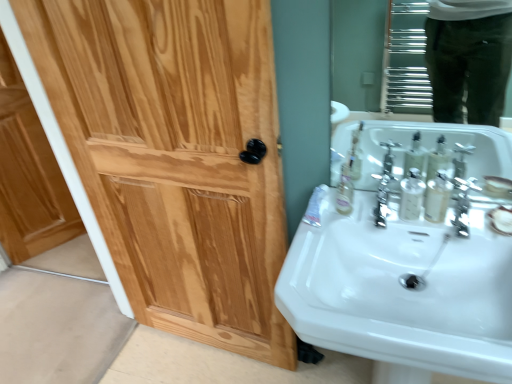
Identify the location of white glossy tube at lower right. Image resolution: width=512 pixels, height=384 pixels. (315, 206).

What is the approximate width of white glossy tube at lower right?

The width of white glossy tube at lower right is 6.39 inches.

The image size is (512, 384). What do you see at coordinates (437, 197) in the screenshot? I see `translucent plastic mouthwash at sink right, which ranks as the 2th mouthwash in left-to-right order` at bounding box center [437, 197].

This screenshot has width=512, height=384. Describe the element at coordinates (380, 56) in the screenshot. I see `glossy chrome mirror at upper right` at that location.

Locate an element on the screen. Image resolution: width=512 pixels, height=384 pixels. light brown wood door at left is located at coordinates pos(29,175).

Measure the distance between light brown wood door at left and camera.

The distance of light brown wood door at left from camera is 6.05 feet.

The image size is (512, 384). In order to click on white glossy tube at lower right in this screenshot , I will do `click(315, 206)`.

How far apart are glossy chrome mirror at upper right and white glossy sink at lower right?

glossy chrome mirror at upper right and white glossy sink at lower right are 1.85 meters apart from each other.

Is point (367, 64) positioned before point (499, 382)?

No, (367, 64) is behind (499, 382).

Is glossy chrome mirror at upper right facing away from white glossy sink at lower right?

That's not correct — glossy chrome mirror at upper right is not looking away from white glossy sink at lower right.

Based on the photo, from a real-world perspective, is glossy chrome mirror at upper right physically located above or below white glossy sink at lower right?

glossy chrome mirror at upper right is above white glossy sink at lower right.

Does light brown wood door at left come behind translucent plastic mouthwash at sink right, the first mouthwash positioned from the right?

That is True.

From a real-world perspective, which is physically below, light brown wood door at left or translucent plastic mouthwash at sink right, the first mouthwash positioned from the right?

In real-world perspective, light brown wood door at left is lower.

From the image's perspective, which object appears higher, light brown wood door at left or translucent plastic mouthwash at sink right, which ranks as the 2th mouthwash in left-to-right order?

light brown wood door at left is shown above in the image.

Can you tell me how much translucent plastic mouthwash at sink right, the first mouthwash positioned from the right, and white glossy tube at lower right differ in facing direction?

The facing directions of translucent plastic mouthwash at sink right, the first mouthwash positioned from the right, and white glossy tube at lower right are 2.43 degrees apart.

Considering the relative sizes of translucent plastic mouthwash at sink right, the first mouthwash positioned from the right, and white glossy tube at lower right in the image provided, is translucent plastic mouthwash at sink right, the first mouthwash positioned from the right, smaller than white glossy tube at lower right?

Incorrect, translucent plastic mouthwash at sink right, the first mouthwash positioned from the right, is not smaller in size than white glossy tube at lower right.

Is translucent plastic mouthwash at sink right, the first mouthwash positioned from the right, looking in the opposite direction of white glossy tube at lower right?

That's not correct — translucent plastic mouthwash at sink right, the first mouthwash positioned from the right, is not looking away from white glossy tube at lower right.

Would you say translucent plastic mouthwash at sink right, the first mouthwash positioned from the right, is outside white glossy tube at lower right?

translucent plastic mouthwash at sink right, the first mouthwash positioned from the right, is positioned outside white glossy tube at lower right.

Looking at their sizes, would you say white glossy sink at lower right is wider or thinner than translucent plastic mouthwash at sink right, the first mouthwash positioned from the right?

In the image, white glossy sink at lower right appears to be wider than translucent plastic mouthwash at sink right, the first mouthwash positioned from the right.

Considering the relative positions of white glossy sink at lower right and translucent plastic mouthwash at sink right, which ranks as the 2th mouthwash in left-to-right order, in the image provided, is white glossy sink at lower right to the left or to the right of translucent plastic mouthwash at sink right, which ranks as the 2th mouthwash in left-to-right order,?

Based on their positions, white glossy sink at lower right is located to the left of translucent plastic mouthwash at sink right, which ranks as the 2th mouthwash in left-to-right order.

From a real-world perspective, is white glossy sink at lower right located beneath translucent plastic mouthwash at sink right, the first mouthwash positioned from the right?

Indeed, from a real-world perspective, white glossy sink at lower right is positioned beneath translucent plastic mouthwash at sink right, the first mouthwash positioned from the right.

From the image's perspective, would you say white glossy sink at lower right is shown under translucent plastic mouthwash at sink right, which ranks as the 2th mouthwash in left-to-right order?

Correct, white glossy sink at lower right appears lower than translucent plastic mouthwash at sink right, which ranks as the 2th mouthwash in left-to-right order, in the image.

From the image's perspective, is glossy chrome mirror at upper right above or below satin nickel faucet at right?

glossy chrome mirror at upper right is situated higher than satin nickel faucet at right in the image.

Looking at this image, from a real-world perspective, is glossy chrome mirror at upper right located beneath satin nickel faucet at right?

No, from a real-world perspective, glossy chrome mirror at upper right is not below satin nickel faucet at right.

Find the location of a particular element. This screenshot has width=512, height=384. tap that appears on the right of glossy chrome mirror at upper right is located at coordinates (462, 206).

I want to click on mirror located in front of the clear plastic mouthwash at right, which is the 1th mouthwash in left-to-right order, so click(380, 56).

From the picture: Which object is further away from the camera taking this photo, clear plastic mouthwash at right, the second mouthwash from the right, or glossy chrome mirror at upper right?

Positioned behind is clear plastic mouthwash at right, the second mouthwash from the right.

Is clear plastic mouthwash at right, which is the 1th mouthwash in left-to-right order, smaller than glossy chrome mirror at upper right?

Yes.

Is clear plastic mouthwash at right, the second mouthwash from the right, positioned with its back to glossy chrome mirror at upper right?

Absolutely, clear plastic mouthwash at right, the second mouthwash from the right, is directed away from glossy chrome mirror at upper right.

In the image, is polished chrome faucet at center positioned in front of or behind satin nickel faucet at right?

polished chrome faucet at center is positioned farther from the viewer than satin nickel faucet at right.

Is satin nickel faucet at right located within polished chrome faucet at center?

No, satin nickel faucet at right is not surrounded by polished chrome faucet at center.

Which object is thinner, polished chrome faucet at center or satin nickel faucet at right?

With smaller width is polished chrome faucet at center.

Considering the sizes of polished chrome faucet at center and satin nickel faucet at right in the image, is polished chrome faucet at center taller or shorter than satin nickel faucet at right?

In the image, polished chrome faucet at center appears to be taller than satin nickel faucet at right.

Where is `sink located on the left of glossy chrome mirror at upper right`? The width and height of the screenshot is (512, 384). sink located on the left of glossy chrome mirror at upper right is located at coordinates (409, 268).

Locate an element on the screen. The width and height of the screenshot is (512, 384). door that is under the translucent plastic mouthwash at sink right, which ranks as the 2th mouthwash in left-to-right order (from a real-world perspective) is located at coordinates (29, 175).

Considering their positions, is glossy chrome mirror at upper right positioned closer to white glossy tube at lower right than white glossy sink at lower right?

white glossy sink at lower right is positioned closer to the anchor white glossy tube at lower right.

Considering their positions, is satin nickel faucet at right positioned further to white glossy tube at lower right than clear plastic mouthwash at right, which is the 1th mouthwash in left-to-right order?

satin nickel faucet at right is positioned further to the anchor white glossy tube at lower right.

When comparing their distances from glossy chrome mirror at upper right, does white glossy sink at lower right or white glossy tube at lower right seem further?

white glossy tube at lower right.

Based on their spatial positions, is translucent plastic mouthwash at sink right, which ranks as the 2th mouthwash in left-to-right order, or polished chrome faucet at center further from light brown wood door at left?

The object further to light brown wood door at left is translucent plastic mouthwash at sink right, which ranks as the 2th mouthwash in left-to-right order.

Looking at the image, which one is located further to translucent plastic mouthwash at sink right, the first mouthwash positioned from the right, polished chrome faucet at center or white glossy sink at lower right?

white glossy sink at lower right lies further to translucent plastic mouthwash at sink right, the first mouthwash positioned from the right, than the other object.

Which object lies nearer to the anchor point glossy chrome mirror at upper right, white glossy tube at lower right or light brown wood door at left?

white glossy tube at lower right.

Considering their positions, is light brown wood door at left positioned further to white glossy tube at lower right than glossy chrome mirror at upper right?

glossy chrome mirror at upper right lies further to white glossy tube at lower right than the other object.

Consider the image. Based on their spatial positions, is satin nickel faucet at right or light brown wood door at left further from glossy chrome mirror at upper right?

light brown wood door at left lies further to glossy chrome mirror at upper right than the other object.

This screenshot has height=384, width=512. In order to click on mirror between white glossy tube at lower right and satin nickel faucet at right from left to right in this screenshot , I will do `click(380, 56)`.

Identify the location of mirror between light brown wood door at left and translucent plastic mouthwash at sink right, the first mouthwash positioned from the right, from left to right. The height and width of the screenshot is (384, 512). (380, 56).

The width and height of the screenshot is (512, 384). I want to click on plumbing fixture between glossy chrome mirror at upper right and white glossy sink at lower right vertically, so click(x=385, y=197).

Where is `plumbing fixture located between light brown wood door at left and glossy chrome mirror at upper right in the left-right direction`? Image resolution: width=512 pixels, height=384 pixels. plumbing fixture located between light brown wood door at left and glossy chrome mirror at upper right in the left-right direction is located at coordinates (385, 197).